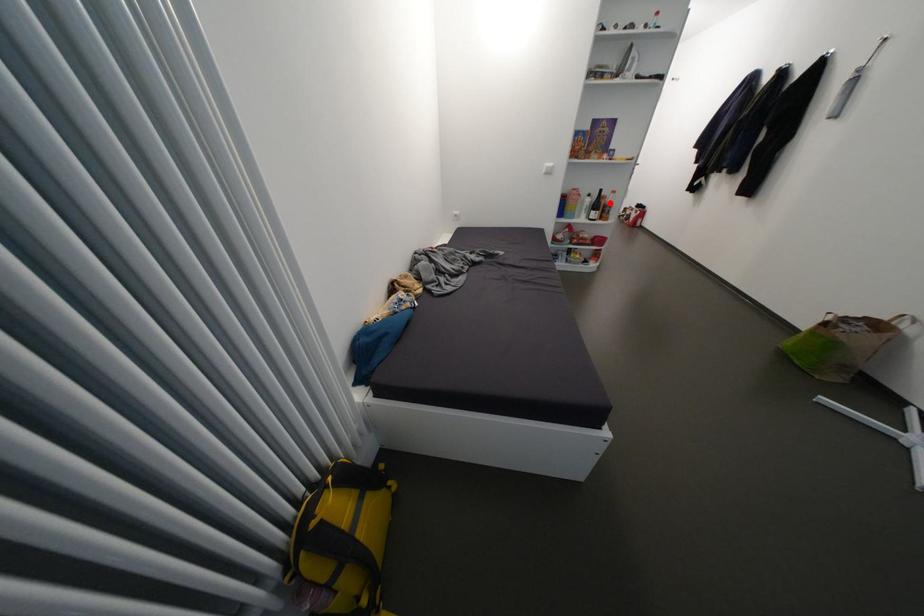
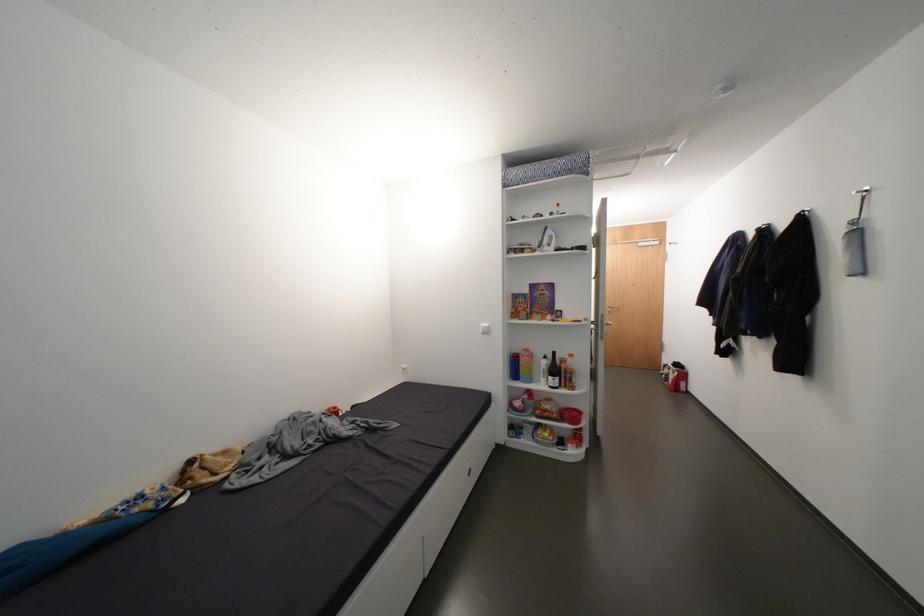
Question: I am providing you with two images of the same scene from different viewpoints. Image1 has a red point marked. In image2, the corresponding 3D location appears at what relative position? Reply with the corresponding letter.

Choices:
 (A) Closer
 (B) Farther

Answer: (B)